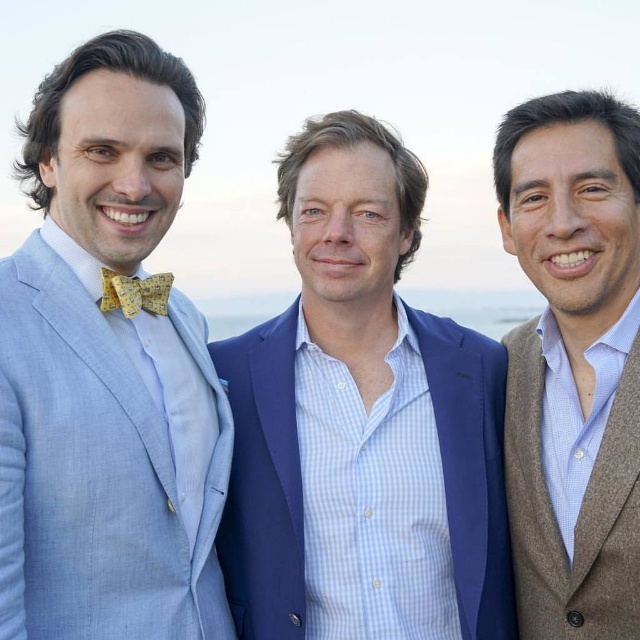
Question: Which point is closer to the camera?

Choices:
 (A) brown wool sweater at right
 (B) light blue linen suit at left
 (C) yellow floral fabric bow tie at center
 (D) blue textured suit at center

Answer: (B)

Question: Is light blue linen suit at left thinner than yellow floral fabric bow tie at center?

Choices:
 (A) no
 (B) yes

Answer: (A)

Question: Does brown wool sweater at right come behind yellow floral fabric bow tie at center?

Choices:
 (A) no
 (B) yes

Answer: (A)

Question: Is light blue linen suit at left in front of brown wool sweater at right?

Choices:
 (A) no
 (B) yes

Answer: (B)

Question: Which point is closer to the camera?

Choices:
 (A) (147, 310)
 (B) (396, 321)
 (C) (58, 561)
 (D) (588, 316)

Answer: (C)

Question: Estimate the real-world distances between objects in this image. Which object is closer to the yellow floral fabric bow tie at center?

Choices:
 (A) light blue linen suit at left
 (B) brown wool sweater at right
 (C) blue textured suit at center

Answer: (A)